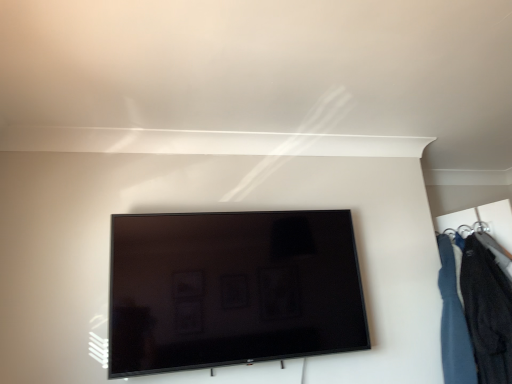
Question: From the image's perspective, is black glossy tv at center on top of velvet dark blue jacket at right?

Choices:
 (A) yes
 (B) no

Answer: (A)

Question: Does black glossy tv at center have a greater width compared to velvet dark blue jacket at right?

Choices:
 (A) no
 (B) yes

Answer: (A)

Question: Does black glossy tv at center lie behind velvet dark blue jacket at right?

Choices:
 (A) yes
 (B) no

Answer: (B)

Question: Would you say black glossy tv at center is outside velvet dark blue jacket at right?

Choices:
 (A) yes
 (B) no

Answer: (A)

Question: Does black glossy tv at center appear on the right side of velvet dark blue jacket at right?

Choices:
 (A) yes
 (B) no

Answer: (B)

Question: Does black glossy tv at center touch velvet dark blue jacket at right?

Choices:
 (A) yes
 (B) no

Answer: (B)

Question: Does velvet dark blue jacket at right have a lesser height compared to black glossy tv at center?

Choices:
 (A) no
 (B) yes

Answer: (A)

Question: From the image's perspective, is velvet dark blue jacket at right on black glossy tv at center?

Choices:
 (A) yes
 (B) no

Answer: (B)

Question: From a real-world perspective, is velvet dark blue jacket at right located higher than black glossy tv at center?

Choices:
 (A) yes
 (B) no

Answer: (B)

Question: Is velvet dark blue jacket at right smaller than black glossy tv at center?

Choices:
 (A) yes
 (B) no

Answer: (A)

Question: Is black glossy tv at center inside velvet dark blue jacket at right?

Choices:
 (A) yes
 (B) no

Answer: (B)

Question: Considering the relative sizes of velvet dark blue jacket at right and black glossy tv at center in the image provided, is velvet dark blue jacket at right bigger than black glossy tv at center?

Choices:
 (A) yes
 (B) no

Answer: (B)

Question: In terms of width, does black glossy tv at center look wider or thinner when compared to velvet dark blue jacket at right?

Choices:
 (A) thin
 (B) wide

Answer: (A)